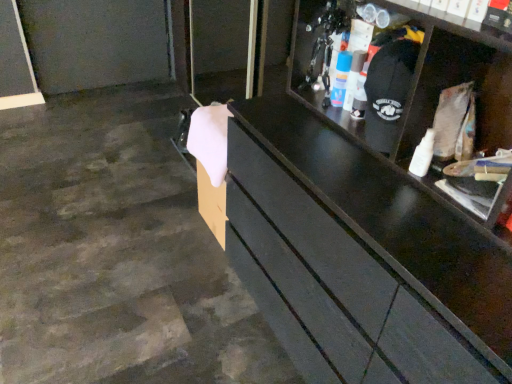
What do you see at coordinates (340, 78) in the screenshot? Image resolution: width=512 pixels, height=384 pixels. I see `white glossy spray can at upper center, the first toiletry viewed from the left` at bounding box center [340, 78].

What is the approximate width of white glossy spray can at upper center, the first toiletry viewed from the left?

1.83 inches.

Locate an element on the screen. This screenshot has width=512, height=384. white glossy spray can at upper center, the first toiletry viewed from the left is located at coordinates (340, 78).

The width and height of the screenshot is (512, 384). I want to click on matte plastic spray can at upper right, positioned as the 1th toiletry in right-to-left order, so click(354, 77).

What is the approximate height of matte plastic spray can at upper right, positioned as the 1th toiletry in right-to-left order?

The height of matte plastic spray can at upper right, positioned as the 1th toiletry in right-to-left order, is 7.36 inches.

Measure the distance between point (354, 77) and camera.

Point (354, 77) and camera are 1.28 meters apart from each other.

Describe the element at coordinates (354, 77) in the screenshot. I see `matte plastic spray can at upper right, arranged as the second toiletry when viewed from the left` at that location.

Image resolution: width=512 pixels, height=384 pixels. I want to click on white glossy spray can at upper center, the second toiletry in the right-to-left sequence, so click(340, 78).

Is white glossy spray can at upper center, the second toiletry in the right-to-left sequence, at the right side of matte plastic spray can at upper right, positioned as the 1th toiletry in right-to-left order?

In fact, white glossy spray can at upper center, the second toiletry in the right-to-left sequence, is to the left of matte plastic spray can at upper right, positioned as the 1th toiletry in right-to-left order.

Is white glossy spray can at upper center, the second toiletry in the right-to-left sequence, further to camera compared to matte plastic spray can at upper right, positioned as the 1th toiletry in right-to-left order?

Yes, white glossy spray can at upper center, the second toiletry in the right-to-left sequence, is further from the camera.

Considering the points (344, 94) and (348, 77), which point is in front, point (344, 94) or point (348, 77)?

Point (348, 77)

From the image's perspective, which one is positioned higher, white glossy spray can at upper center, the first toiletry viewed from the left, or matte plastic spray can at upper right, positioned as the 1th toiletry in right-to-left order?

white glossy spray can at upper center, the first toiletry viewed from the left.

From a real-world perspective, which is physically above, white glossy spray can at upper center, the second toiletry in the right-to-left sequence, or matte plastic spray can at upper right, arranged as the second toiletry when viewed from the left?

matte plastic spray can at upper right, arranged as the second toiletry when viewed from the left, is physically above.

Is white glossy spray can at upper center, the second toiletry in the right-to-left sequence, thinner than matte plastic spray can at upper right, arranged as the second toiletry when viewed from the left?

Correct, the width of white glossy spray can at upper center, the second toiletry in the right-to-left sequence, is less than that of matte plastic spray can at upper right, arranged as the second toiletry when viewed from the left.

Who is taller, white glossy spray can at upper center, the second toiletry in the right-to-left sequence, or matte plastic spray can at upper right, arranged as the second toiletry when viewed from the left?

With more height is matte plastic spray can at upper right, arranged as the second toiletry when viewed from the left.

Is white glossy spray can at upper center, the second toiletry in the right-to-left sequence, bigger than matte plastic spray can at upper right, arranged as the second toiletry when viewed from the left?

No.

Choose the correct answer: Is white glossy spray can at upper center, the second toiletry in the right-to-left sequence, inside matte plastic spray can at upper right, arranged as the second toiletry when viewed from the left, or outside it?

white glossy spray can at upper center, the second toiletry in the right-to-left sequence, cannot be found inside matte plastic spray can at upper right, arranged as the second toiletry when viewed from the left.

Is white glossy spray can at upper center, the second toiletry in the right-to-left sequence, next to matte plastic spray can at upper right, arranged as the second toiletry when viewed from the left?

Yes, white glossy spray can at upper center, the second toiletry in the right-to-left sequence, is next to matte plastic spray can at upper right, arranged as the second toiletry when viewed from the left.

Is white glossy spray can at upper center, the second toiletry in the right-to-left sequence, facing towards matte plastic spray can at upper right, arranged as the second toiletry when viewed from the left?

No, white glossy spray can at upper center, the second toiletry in the right-to-left sequence, is not turned towards matte plastic spray can at upper right, arranged as the second toiletry when viewed from the left.

Locate an element on the screen. The width and height of the screenshot is (512, 384). toiletry below the matte plastic spray can at upper right, arranged as the second toiletry when viewed from the left (from a real-world perspective) is located at coordinates (340, 78).

Does matte plastic spray can at upper right, positioned as the 1th toiletry in right-to-left order, appear on the left side of white glossy spray can at upper center, the first toiletry viewed from the left?

In fact, matte plastic spray can at upper right, positioned as the 1th toiletry in right-to-left order, is to the right of white glossy spray can at upper center, the first toiletry viewed from the left.

Between matte plastic spray can at upper right, positioned as the 1th toiletry in right-to-left order, and white glossy spray can at upper center, the first toiletry viewed from the left, which one is positioned behind?

white glossy spray can at upper center, the first toiletry viewed from the left.

Is point (350, 76) closer to viewer compared to point (340, 84)?

Yes, point (350, 76) is closer to viewer.

From the image's perspective, is matte plastic spray can at upper right, arranged as the second toiletry when viewed from the left, positioned above or below white glossy spray can at upper center, the first toiletry viewed from the left?

Based on their image positions, matte plastic spray can at upper right, arranged as the second toiletry when viewed from the left, is located beneath white glossy spray can at upper center, the first toiletry viewed from the left.

From a real-world perspective, is matte plastic spray can at upper right, positioned as the 1th toiletry in right-to-left order, located beneath white glossy spray can at upper center, the first toiletry viewed from the left?

Actually, matte plastic spray can at upper right, positioned as the 1th toiletry in right-to-left order, is physically above white glossy spray can at upper center, the first toiletry viewed from the left, in the real world.

Does matte plastic spray can at upper right, positioned as the 1th toiletry in right-to-left order, have a greater width compared to white glossy spray can at upper center, the first toiletry viewed from the left?

Indeed, matte plastic spray can at upper right, positioned as the 1th toiletry in right-to-left order, has a greater width compared to white glossy spray can at upper center, the first toiletry viewed from the left.

From the picture: Which of these two, matte plastic spray can at upper right, arranged as the second toiletry when viewed from the left, or white glossy spray can at upper center, the second toiletry in the right-to-left sequence, stands taller?

With more height is matte plastic spray can at upper right, arranged as the second toiletry when viewed from the left.

Considering the relative sizes of matte plastic spray can at upper right, positioned as the 1th toiletry in right-to-left order, and white glossy spray can at upper center, the second toiletry in the right-to-left sequence, in the image provided, is matte plastic spray can at upper right, positioned as the 1th toiletry in right-to-left order, bigger than white glossy spray can at upper center, the second toiletry in the right-to-left sequence,?

Indeed, matte plastic spray can at upper right, positioned as the 1th toiletry in right-to-left order, has a larger size compared to white glossy spray can at upper center, the second toiletry in the right-to-left sequence.

Do you think matte plastic spray can at upper right, arranged as the second toiletry when viewed from the left, is within white glossy spray can at upper center, the second toiletry in the right-to-left sequence, or outside of it?

matte plastic spray can at upper right, arranged as the second toiletry when viewed from the left, lies outside white glossy spray can at upper center, the second toiletry in the right-to-left sequence.

Is matte plastic spray can at upper right, positioned as the 1th toiletry in right-to-left order, in contact with white glossy spray can at upper center, the second toiletry in the right-to-left sequence?

Yes, matte plastic spray can at upper right, positioned as the 1th toiletry in right-to-left order, is next to white glossy spray can at upper center, the second toiletry in the right-to-left sequence.

Does matte plastic spray can at upper right, positioned as the 1th toiletry in right-to-left order, turn towards white glossy spray can at upper center, the first toiletry viewed from the left?

No, matte plastic spray can at upper right, positioned as the 1th toiletry in right-to-left order, does not turn towards white glossy spray can at upper center, the first toiletry viewed from the left.

How different are the orientations of matte plastic spray can at upper right, arranged as the second toiletry when viewed from the left, and white glossy spray can at upper center, the first toiletry viewed from the left, in degrees?

0.00735 degrees separate the facing orientations of matte plastic spray can at upper right, arranged as the second toiletry when viewed from the left, and white glossy spray can at upper center, the first toiletry viewed from the left.

The height and width of the screenshot is (384, 512). There is a white glossy spray can at upper center, the first toiletry viewed from the left. Identify the location of toiletry above it (from a real-world perspective). (354, 77).

Locate an element on the screen. The height and width of the screenshot is (384, 512). toiletry on the left of matte plastic spray can at upper right, positioned as the 1th toiletry in right-to-left order is located at coordinates (340, 78).

This screenshot has width=512, height=384. I want to click on toiletry that appears on the right of white glossy spray can at upper center, the first toiletry viewed from the left, so click(x=354, y=77).